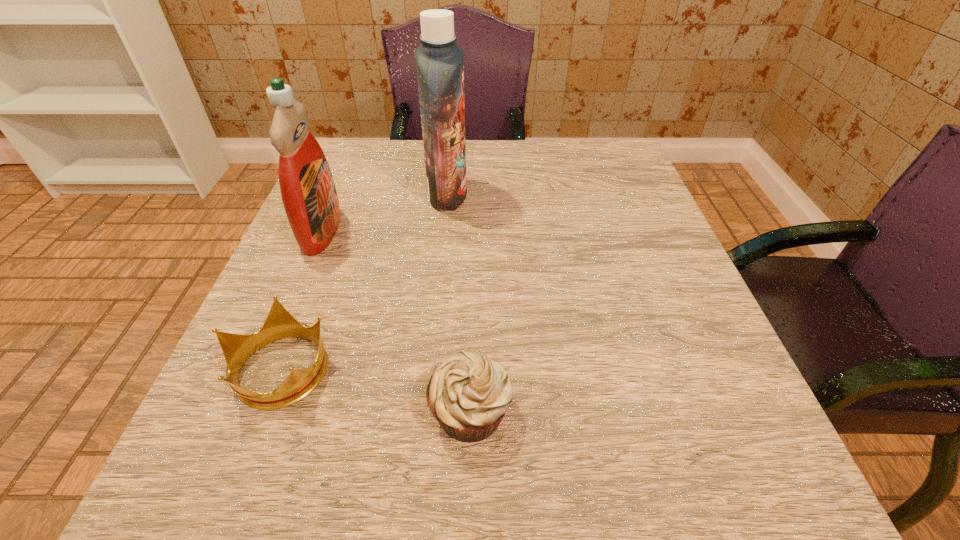
The width and height of the screenshot is (960, 540). I want to click on detergent present at the left edge, so click(x=308, y=192).

Locate an element on the screen. Image resolution: width=960 pixels, height=540 pixels. crown that is at the left edge is located at coordinates (280, 324).

Where is `blank area at the far edge`? The width and height of the screenshot is (960, 540). blank area at the far edge is located at coordinates tap(488, 157).

This screenshot has width=960, height=540. I want to click on vacant space at the left edge, so click(x=255, y=315).

This screenshot has height=540, width=960. I want to click on vacant space at the right edge of the desktop, so click(x=651, y=221).

You are a GUI agent. You are given a task and a screenshot of the screen. Output one action in this format:
    pyautogui.click(x=<x>, y=<y>)
    Task: Click on the free space at the far left corner of the desktop
    The height and width of the screenshot is (540, 960).
    Given the screenshot: What is the action you would take?
    pyautogui.click(x=383, y=166)

What are the coordinates of `vacant area at the near left corner` in the screenshot? It's located at (183, 471).

In the image, there is a desktop. At what (x,y) coordinates should I click in order to perform the action: click on vacant space at the far right corner. Please return your answer as a coordinate pair (x, y). Looking at the image, I should click on (613, 177).

I want to click on free space between the second tallest object and the crown, so click(301, 300).

Find the location of a particular element. The height and width of the screenshot is (540, 960). vacant area that lies between the detergent and the muffin is located at coordinates (396, 321).